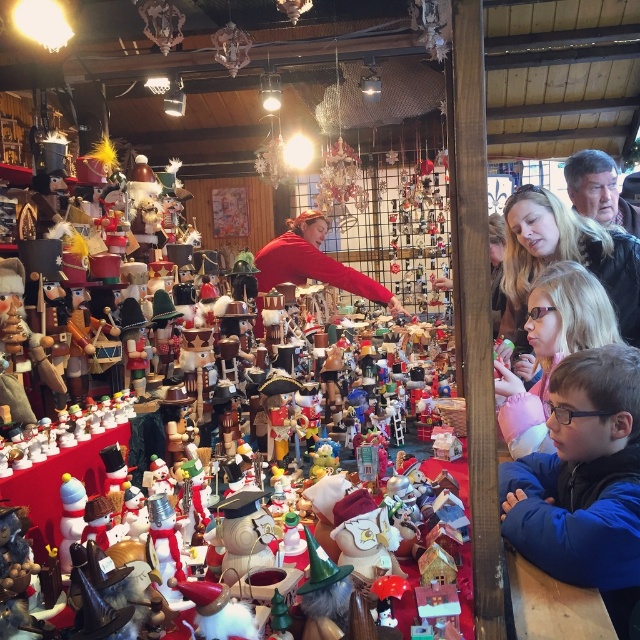
Question: Is blue fleece jacket at lower right to the right of blonde hair at upper right from the viewer's perspective?

Choices:
 (A) yes
 (B) no

Answer: (B)

Question: Among these points, which one is nearest to the camera?

Choices:
 (A) (337, 262)
 (B) (637, 236)

Answer: (B)

Question: Is red matte sweater at center positioned before matte black hair at upper right?

Choices:
 (A) yes
 (B) no

Answer: (B)

Question: Estimate the real-world distances between objects in this image. Which object is closer to the matte black hair at upper right?

Choices:
 (A) blonde hair at upper right
 (B) blue fleece jacket at lower right
 (C) red matte sweater at center

Answer: (A)

Question: Which of the following is the closest to the observer?

Choices:
 (A) (301, 282)
 (B) (572, 184)
 (C) (637, 408)

Answer: (C)

Question: Does blue fleece jacket at lower right come behind blonde hair at upper right?

Choices:
 (A) no
 (B) yes

Answer: (A)